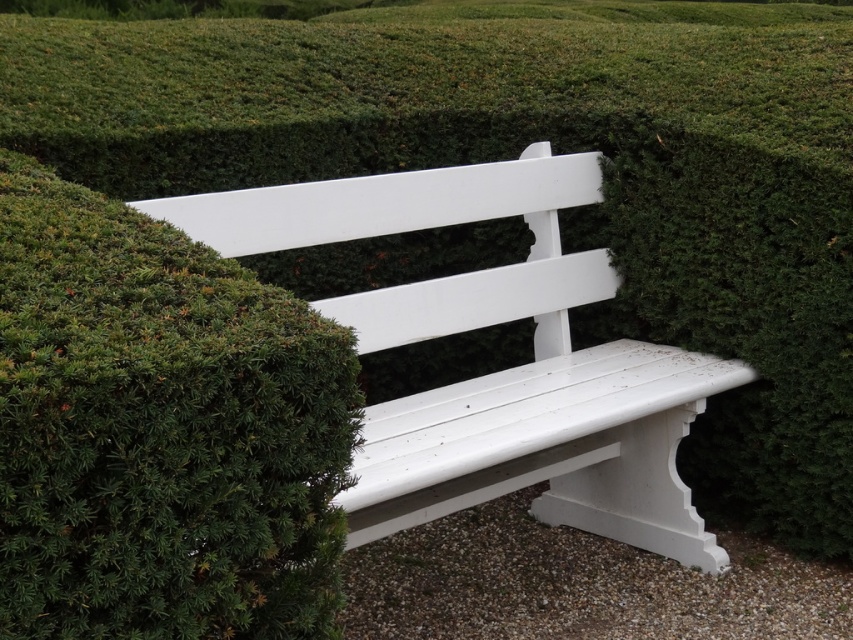
Can you confirm if green textured shrub at upper left is positioned to the left of white painted wood bench at center?

Yes, green textured shrub at upper left is to the left of white painted wood bench at center.

Does point (167, 269) come closer to viewer compared to point (549, 230)?

Yes, point (167, 269) is closer to viewer.

Locate an element on the screen. green textured shrub at upper left is located at coordinates (160, 429).